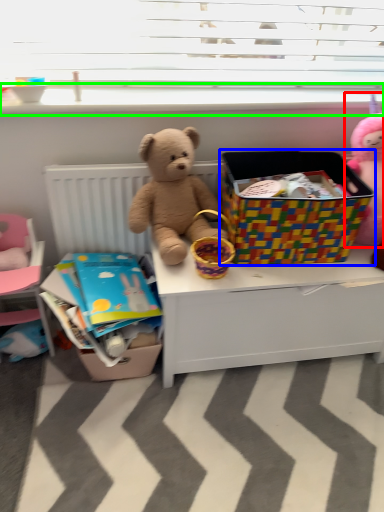
Question: Which is nearer to the toy (highlighted by a red box)? box (highlighted by a blue box) or window sill (highlighted by a green box).

Choices:
 (A) box
 (B) window sill

Answer: (A)